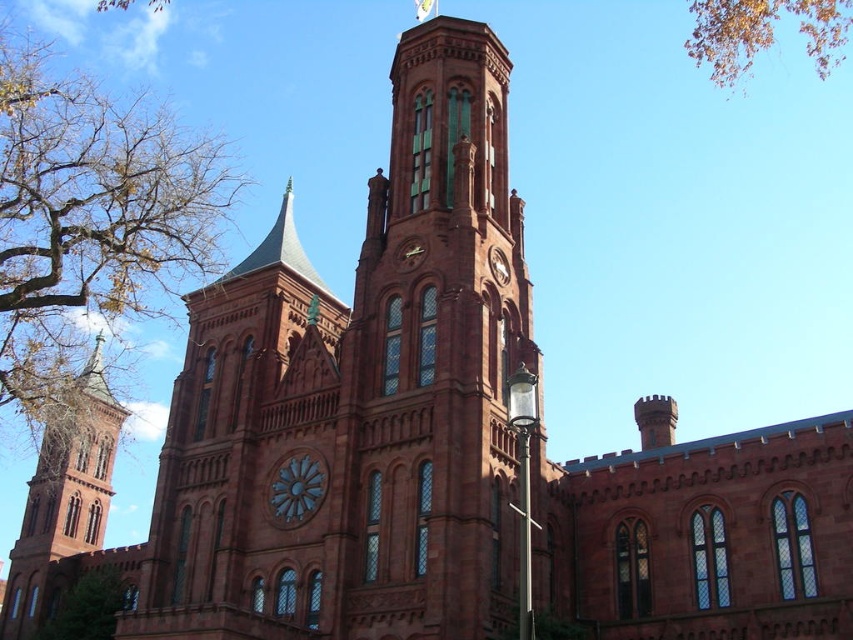
Is brown leafy tree at left shorter than yellow leafy branches at upper right?

No.

Which is behind, point (33, 250) or point (846, 16)?

Positioned behind is point (846, 16).

Where is `brown leafy tree at left`? The image size is (853, 640). brown leafy tree at left is located at coordinates (90, 221).

Is point (368, 256) behind point (93, 628)?

No, it is not.

This screenshot has width=853, height=640. I want to click on matte brick tower at center, so click(x=433, y=356).

Is point (396, 432) positioned behind point (86, 627)?

No.

Locate an element on the screen. The width and height of the screenshot is (853, 640). matte brick tower at center is located at coordinates (433, 356).

Between point (61, 244) and point (54, 620), which one is positioned behind?

The point (54, 620) is more distant.

Does brown leafy tree at left lie in front of green leafy tree at lower left?

Yes, it is in front of green leafy tree at lower left.

The height and width of the screenshot is (640, 853). What do you see at coordinates (90, 221) in the screenshot? I see `brown leafy tree at left` at bounding box center [90, 221].

Where is `brown leafy tree at left`? The width and height of the screenshot is (853, 640). brown leafy tree at left is located at coordinates (90, 221).